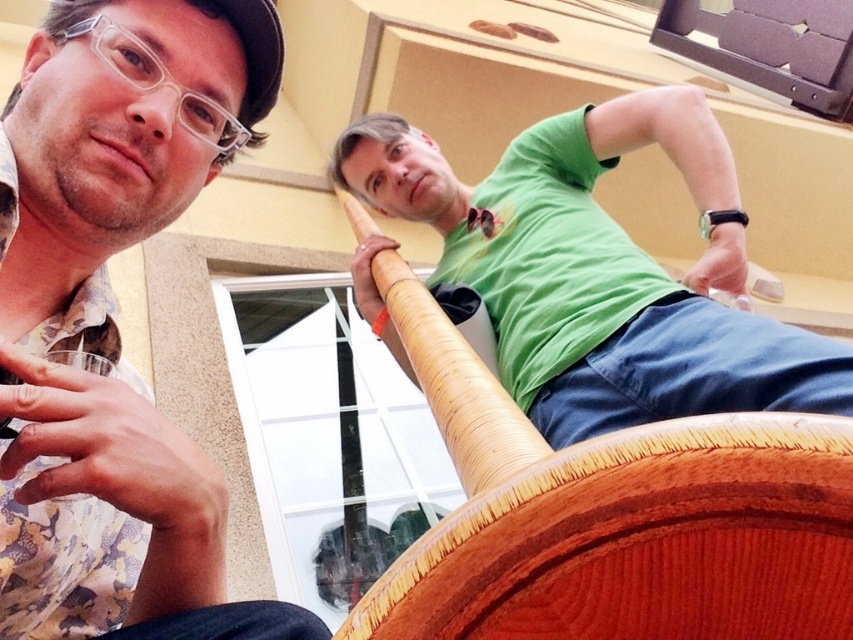
You are a photographer trying to capture a candid shot of the two people in the scene. You want to ensure that the matte floral shirt at left and the wooden chair at upper center are both in the frame. Based on their positions, which object is closer to the left edge of the photo?

The matte floral shirt at left is positioned to the left of the wooden chair at upper center, so it will be closer to the left edge of the photo.